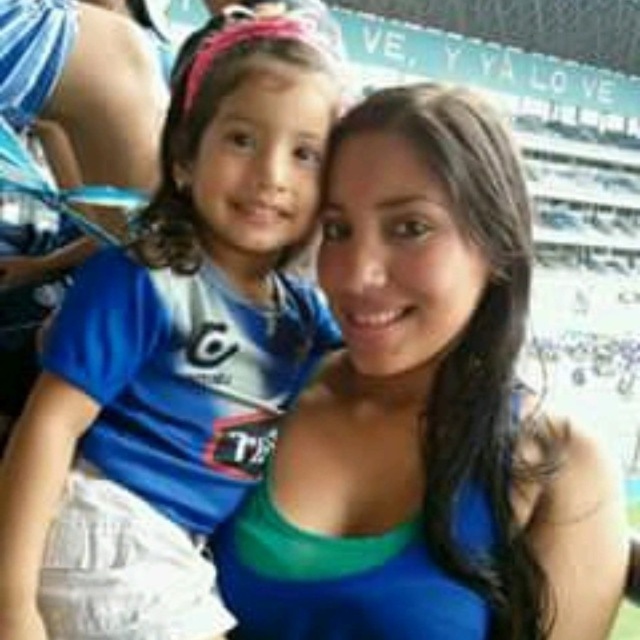
Does blue fabric dress at center appear on the left side of blue jersey at left?

In fact, blue fabric dress at center is to the right of blue jersey at left.

Does blue fabric dress at center have a larger size compared to blue jersey at left?

Actually, blue fabric dress at center might be smaller than blue jersey at left.

Is point (518, 456) farther from camera compared to point (256, 144)?

Yes, it is behind point (256, 144).

Image resolution: width=640 pixels, height=640 pixels. Identify the location of blue fabric dress at center. tap(420, 408).